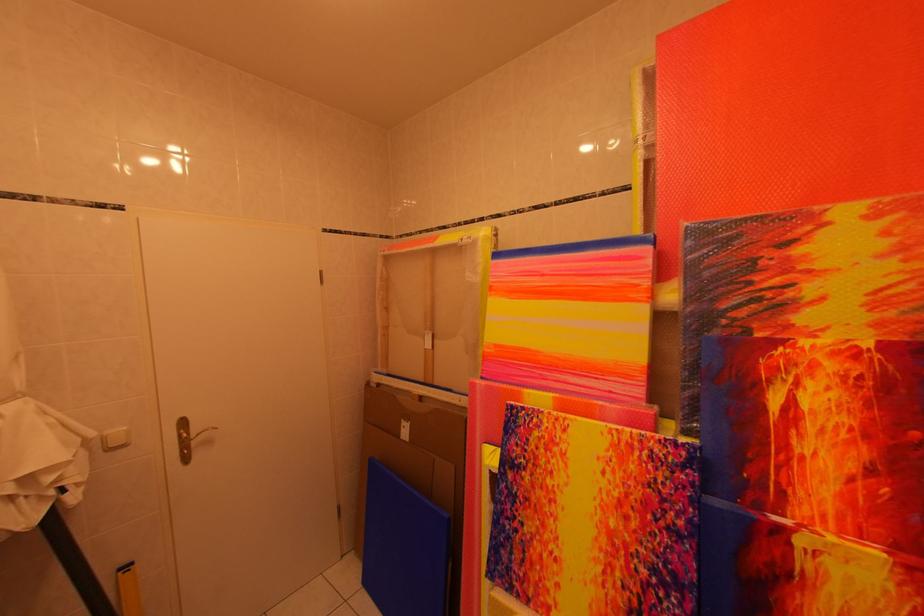
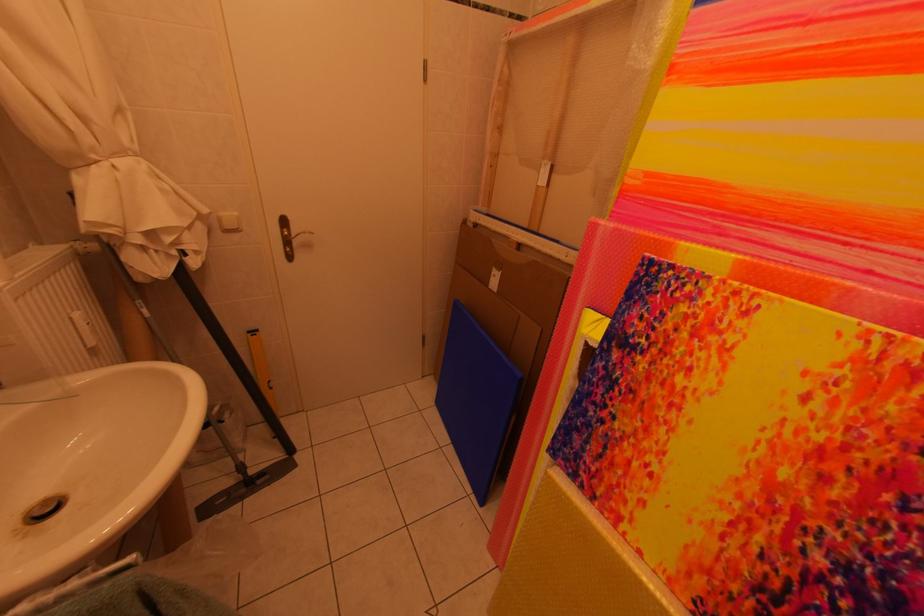
Find the pixel in the second image that matches [116,437] in the first image.

(229, 217)